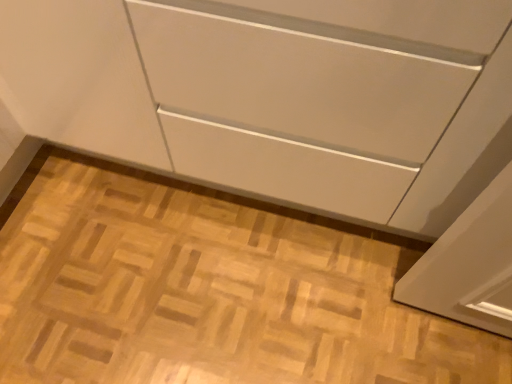
You are a GUI agent. You are given a task and a screenshot of the screen. Output one action in this format:
    pyautogui.click(x=<x>, y=<y>)
    Task: Click on the vacant point above matte white cabinet at center (from a real-world perspective)
    This screenshot has width=512, height=384.
    Given the screenshot: What is the action you would take?
    pyautogui.click(x=182, y=278)